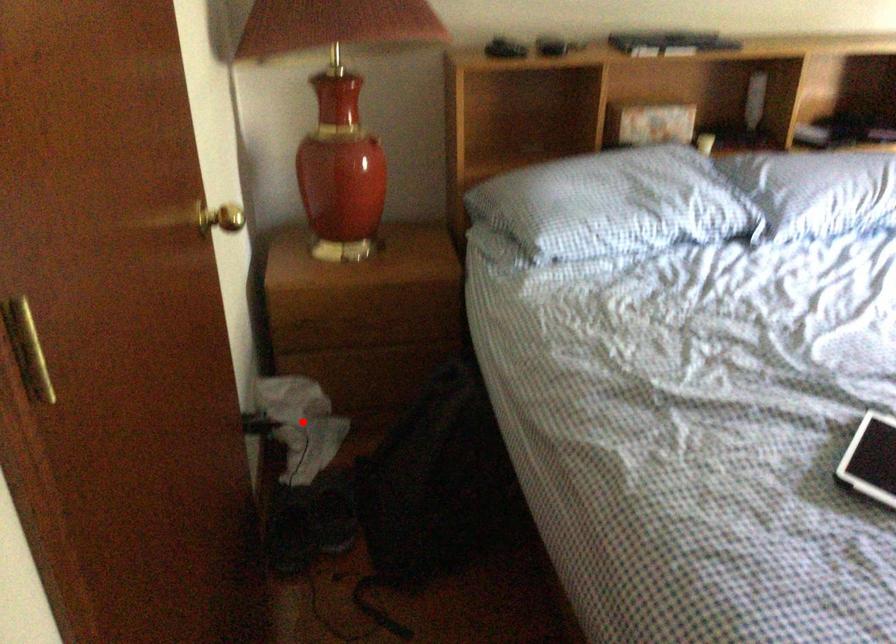
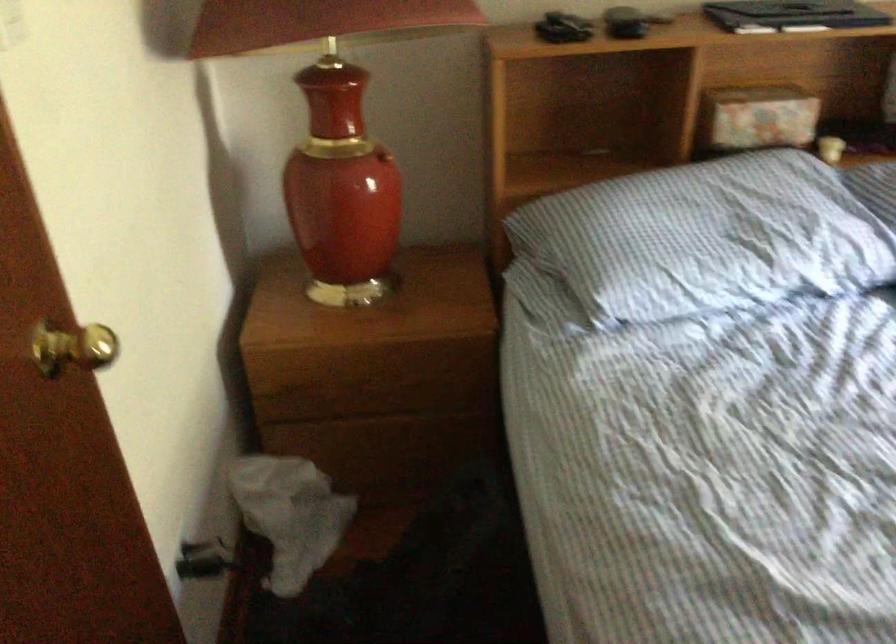
Where in the second image is the point corresponding to the highlighted location from the first image?

(289, 515)